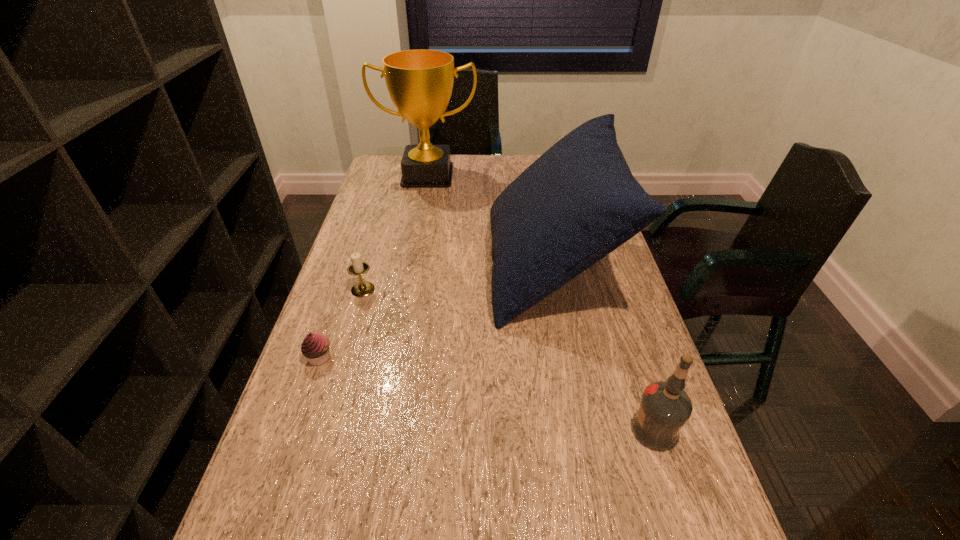
Where is `vacant point located 0.150m on the facing side of the cushion`? vacant point located 0.150m on the facing side of the cushion is located at coordinates (437, 267).

Identify the location of free region located 0.230m on the front label of the third tallest object. This screenshot has height=540, width=960. (515, 430).

Where is `vacant space situated on the front label of the third tallest object`? vacant space situated on the front label of the third tallest object is located at coordinates (606, 430).

At what (x,y) coordinates should I click in order to perform the action: click on free location located on the front label of the third tallest object. Please return your answer as a coordinate pair (x, y). This screenshot has width=960, height=540. Looking at the image, I should click on (444, 430).

This screenshot has height=540, width=960. Find the location of `vacant space located 0.110m on the right of the candle holder`. vacant space located 0.110m on the right of the candle holder is located at coordinates (416, 289).

You are a GUI agent. You are given a task and a screenshot of the screen. Output one action in this format:
    pyautogui.click(x=<x>, y=<y>)
    Task: Click on the free spot located on the front of the second nearest object
    The width and height of the screenshot is (960, 540).
    Given the screenshot: What is the action you would take?
    pyautogui.click(x=275, y=487)

This screenshot has width=960, height=540. Find the location of `object present at the far edge`. object present at the far edge is located at coordinates (420, 82).

In order to click on award that is at the left edge in this screenshot , I will do `click(420, 82)`.

Where is `candle holder that is at the left edge`? The height and width of the screenshot is (540, 960). candle holder that is at the left edge is located at coordinates (364, 288).

Where is `cupcake that is positioned at the left edge`? The width and height of the screenshot is (960, 540). cupcake that is positioned at the left edge is located at coordinates (315, 347).